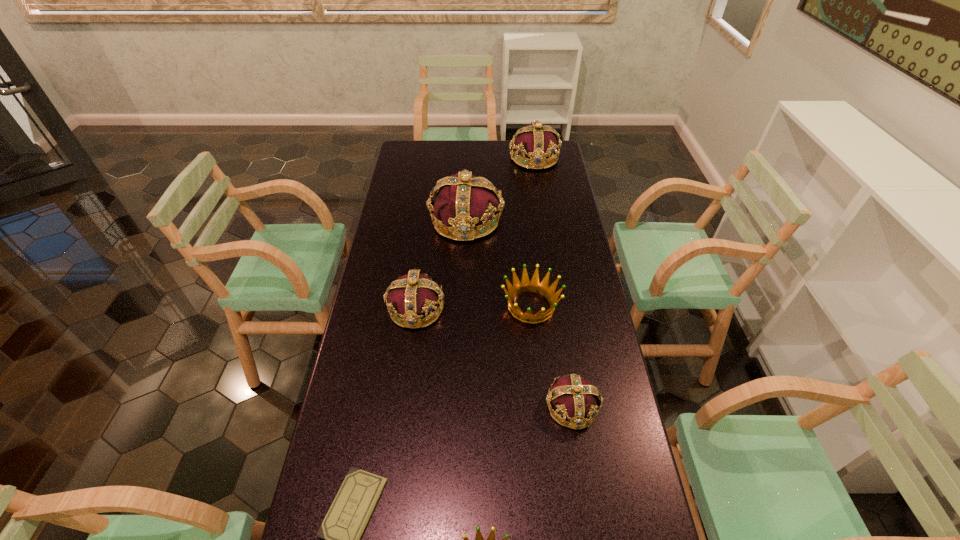
The height and width of the screenshot is (540, 960). I want to click on free space located 0.370m on the left of the fifth shortest crown, so click(430, 158).

The width and height of the screenshot is (960, 540). What are the coordinates of `free space located 0.170m on the back of the fifth shortest object` in the screenshot? It's located at (423, 253).

The width and height of the screenshot is (960, 540). Identify the location of vacant area located on the front of the fifth farthest crown. (586, 493).

You are a GUI agent. You are given a task and a screenshot of the screen. Output one action in this format:
    pyautogui.click(x=<x>, y=<y>)
    Task: Click on the vacant area located 0.380m on the back of the farther golden crown
    
    Given the screenshot: What is the action you would take?
    pyautogui.click(x=521, y=215)

The image size is (960, 540). In order to click on object present at the far edge in this screenshot , I will do `click(535, 142)`.

This screenshot has width=960, height=540. In order to click on object present at the left edge in this screenshot , I will do `click(414, 295)`.

Where is `object that is at the far right corner`? The width and height of the screenshot is (960, 540). object that is at the far right corner is located at coordinates (535, 142).

Where is `vacant area at the far edge`? This screenshot has width=960, height=540. vacant area at the far edge is located at coordinates (443, 154).

In the image, there is a desktop. At what (x,y) coordinates should I click in order to perform the action: click on free region at the left edge. Please return your answer as a coordinate pair (x, y). Looking at the image, I should click on (390, 214).

Where is `vacant space at the right edge of the desktop`? vacant space at the right edge of the desktop is located at coordinates (594, 379).